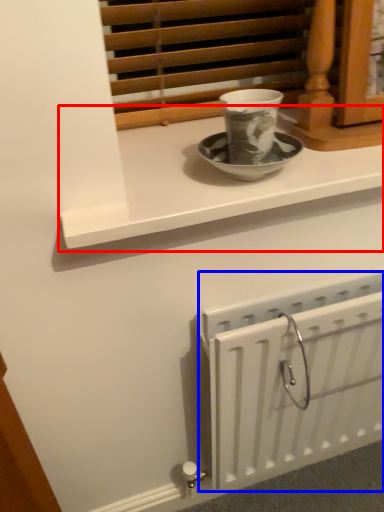
Question: Among these objects, which one is nearest to the camera, window sill (highlighted by a red box) or radiator (highlighted by a blue box)?

Choices:
 (A) window sill
 (B) radiator

Answer: (A)